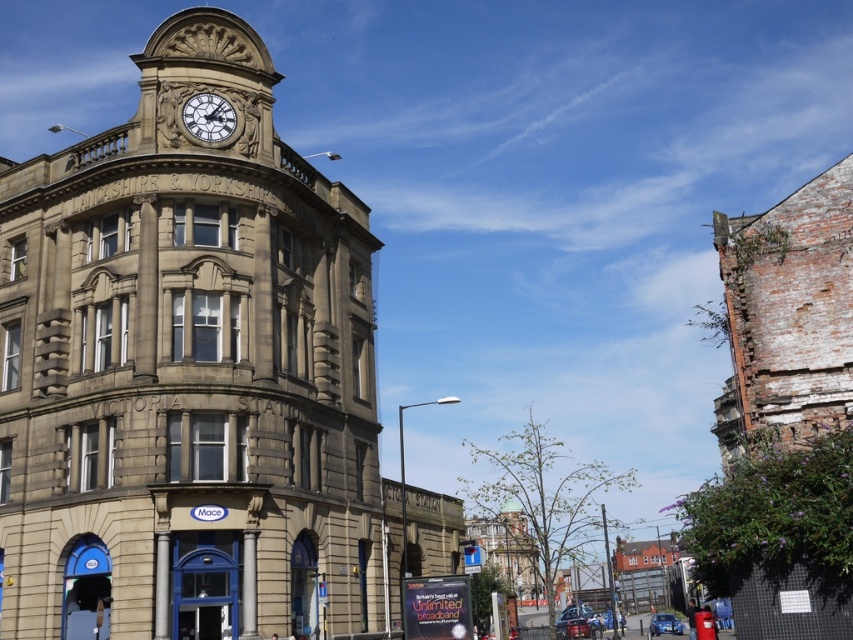
Who is taller, brown stone clock tower at upper center or matte stone clock at upper center?

Standing taller between the two is brown stone clock tower at upper center.

Can you confirm if brown stone clock tower at upper center is bigger than matte stone clock at upper center?

Correct, brown stone clock tower at upper center is larger in size than matte stone clock at upper center.

Is point (136, 230) in front of point (190, 109)?

That is True.

This screenshot has height=640, width=853. Find the location of `brown stone clock tower at upper center`. brown stone clock tower at upper center is located at coordinates coord(187,371).